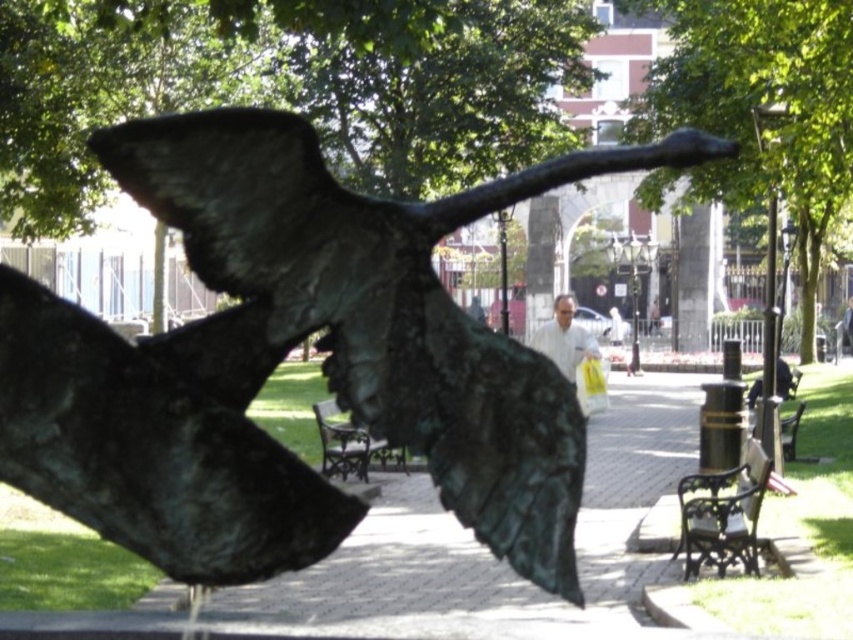
Consider the image. Who is more forward, (165, 164) or (589, 344)?

Positioned in front is point (165, 164).

Does bronze sculpture at center appear over white shirt at center?

Actually, bronze sculpture at center is below white shirt at center.

Where is `bronze sculpture at center`? bronze sculpture at center is located at coordinates (283, 355).

Is bronze textured wing at center to the left of wooden park bench at center from the viewer's perspective?

Incorrect, bronze textured wing at center is not on the left side of wooden park bench at center.

From the picture: Can you confirm if bronze textured wing at center is shorter than wooden park bench at center?

No.

Is point (231, 317) closer to camera compared to point (318, 428)?

Yes.

Where is `bronze textured wing at center`? bronze textured wing at center is located at coordinates (160, 438).

Who is more distant from viewer, (442,497) or (300,534)?

The point (442,497) is behind.

Does bronze sculpture at center appear under bronze textured wing at center?

No, bronze sculpture at center is not below bronze textured wing at center.

Locate an element on the screen. bronze sculpture at center is located at coordinates (283, 355).

In order to click on bronze sculpture at center in this screenshot , I will do `click(283, 355)`.